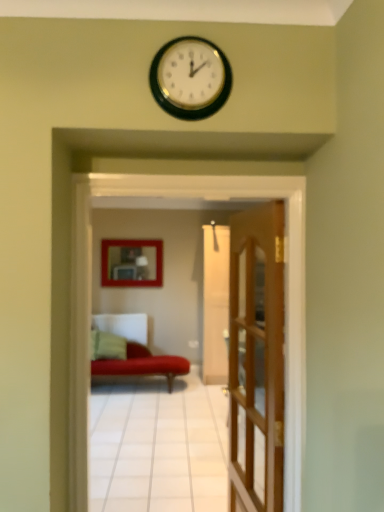
Question: From the image's perspective, is velvet red couch at center above green fabric pillow at lower left?

Choices:
 (A) yes
 (B) no

Answer: (A)

Question: From a real-world perspective, is velvet red couch at center physically above green fabric pillow at lower left?

Choices:
 (A) yes
 (B) no

Answer: (A)

Question: Is velvet red couch at center facing away from green fabric pillow at lower left?

Choices:
 (A) yes
 (B) no

Answer: (B)

Question: Can you confirm if velvet red couch at center is positioned to the left of green fabric pillow at lower left?

Choices:
 (A) yes
 (B) no

Answer: (B)

Question: From the image's perspective, is velvet red couch at center beneath green fabric pillow at lower left?

Choices:
 (A) yes
 (B) no

Answer: (B)

Question: Does velvet red couch at center have a lesser width compared to green fabric pillow at lower left?

Choices:
 (A) no
 (B) yes

Answer: (B)

Question: Is velvet red couch at center oriented away from matte wooden picture frame at center?

Choices:
 (A) yes
 (B) no

Answer: (B)

Question: Can you confirm if velvet red couch at center is smaller than matte wooden picture frame at center?

Choices:
 (A) no
 (B) yes

Answer: (A)

Question: Is velvet red couch at center aimed at matte wooden picture frame at center?

Choices:
 (A) yes
 (B) no

Answer: (A)

Question: From the image's perspective, would you say velvet red couch at center is positioned over matte wooden picture frame at center?

Choices:
 (A) yes
 (B) no

Answer: (B)

Question: Is velvet red couch at center further to camera compared to matte wooden picture frame at center?

Choices:
 (A) no
 (B) yes

Answer: (A)

Question: From the image's perspective, is velvet red couch at center beneath matte wooden picture frame at center?

Choices:
 (A) no
 (B) yes

Answer: (B)

Question: Is wooden door at center completely or partially outside of matte wooden picture frame at center?

Choices:
 (A) no
 (B) yes

Answer: (B)